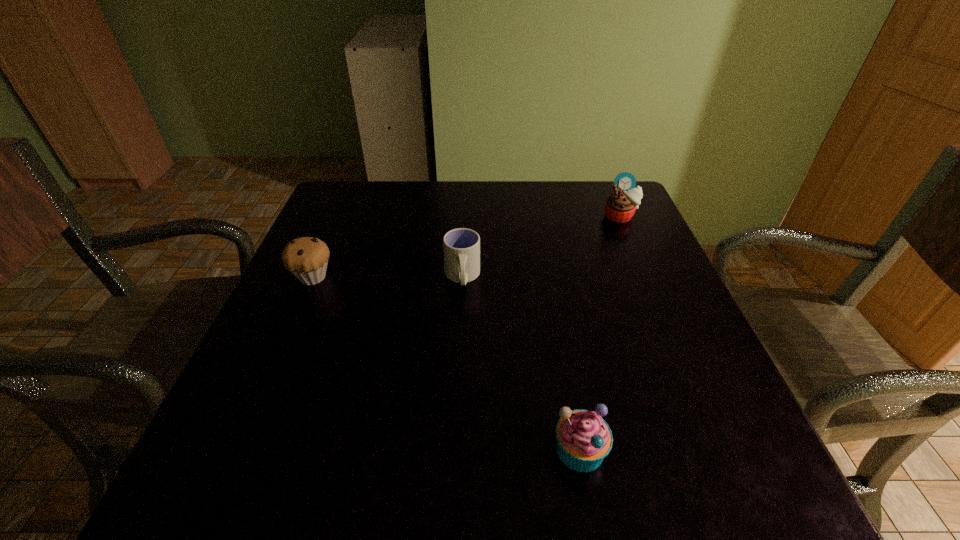
You are a GUI agent. You are given a task and a screenshot of the screen. Output one action in this format:
    pyautogui.click(x=<x>, y=<y>)
    Task: Click on the free space at the far right corner of the desktop
    
    Given the screenshot: What is the action you would take?
    pyautogui.click(x=585, y=194)

The image size is (960, 540). I want to click on free space between the farthest muffin and the third object from right to left, so click(x=541, y=247).

Locate an element on the screen. The image size is (960, 540). vacant space that is in between the second muffin from right to left and the second farthest muffin is located at coordinates (446, 363).

The image size is (960, 540). What are the coordinates of `free space between the second nearest muffin and the second object from right to left` in the screenshot? It's located at (446, 363).

In order to click on vacant area between the third object from right to left and the leftmost object in this screenshot , I will do `click(388, 277)`.

You are a GUI agent. You are given a task and a screenshot of the screen. Output one action in this format:
    pyautogui.click(x=<x>, y=<y>)
    Task: Click on the free space that is in between the cup and the nearest muffin
    
    Given the screenshot: What is the action you would take?
    pyautogui.click(x=521, y=363)

Image resolution: width=960 pixels, height=540 pixels. In order to click on free space between the nearest object and the cup in this screenshot , I will do `click(521, 363)`.

This screenshot has height=540, width=960. I want to click on unoccupied area between the second farthest muffin and the second muffin from right to left, so click(446, 363).

This screenshot has height=540, width=960. Identify the location of free spot between the tallest object and the second object from left to right. (541, 247).

Point out which object is positioned as the third nearest to the leftmost object. Please provide its 2D coordinates. Your answer should be formatted as a tuple, i.e. [(x, y)], where the tuple contains the x and y coordinates of a point satisfying the conditions above.

[(620, 206)]